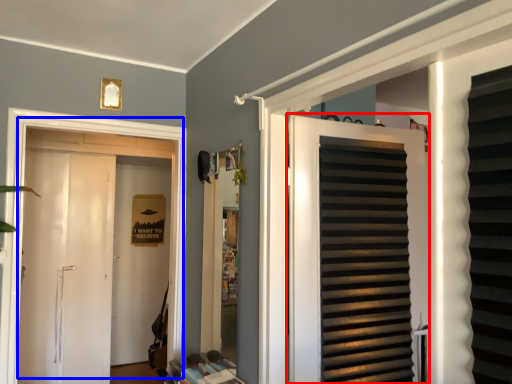
Question: Which object appears closest to the camera in this image, door (highlighted by a red box) or door (highlighted by a blue box)?

Choices:
 (A) door
 (B) door

Answer: (A)